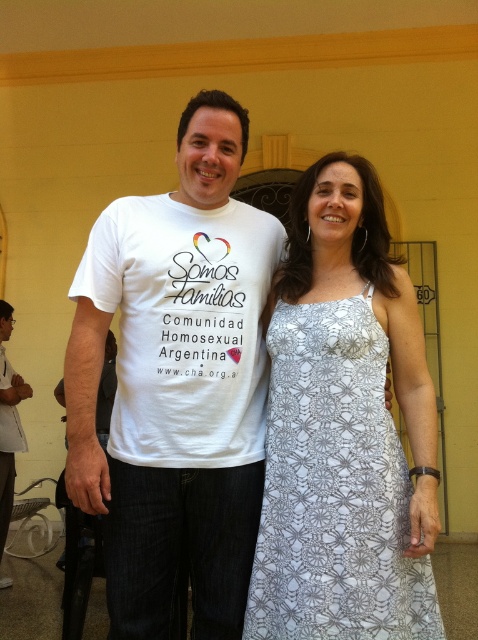
The height and width of the screenshot is (640, 478). What do you see at coordinates (345, 429) in the screenshot?
I see `white printed t-shirt at center` at bounding box center [345, 429].

Who is shorter, white printed t-shirt at center or white cotton t-shirt at center?

Standing shorter between the two is white cotton t-shirt at center.

Does point (368, 572) come behind point (239, 458)?

No.

Where is `white printed t-shirt at center`? white printed t-shirt at center is located at coordinates (345, 429).

Does white printed t-shirt at center come behind white lace dress at center?

Yes, white printed t-shirt at center is further from the viewer.

Describe the element at coordinates (345, 429) in the screenshot. I see `white printed t-shirt at center` at that location.

I want to click on white printed t-shirt at center, so click(x=345, y=429).

Which is above, white lace dress at center or white matte t-shirt at center?

white lace dress at center is higher up.

Image resolution: width=478 pixels, height=640 pixels. Describe the element at coordinates (335, 488) in the screenshot. I see `white lace dress at center` at that location.

Where is `white lace dress at center`? The height and width of the screenshot is (640, 478). white lace dress at center is located at coordinates (335, 488).